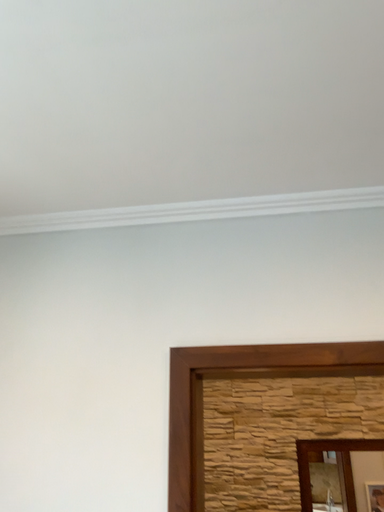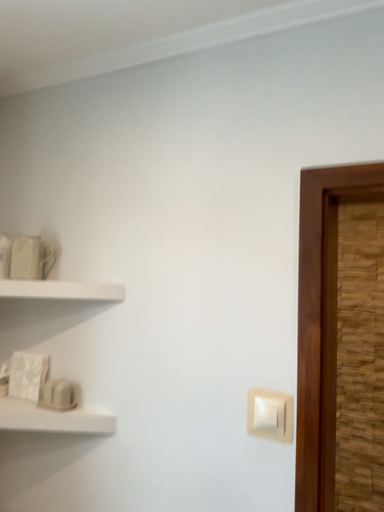
Question: How did the camera likely rotate when shooting the video?

Choices:
 (A) rotated right
 (B) rotated left

Answer: (B)